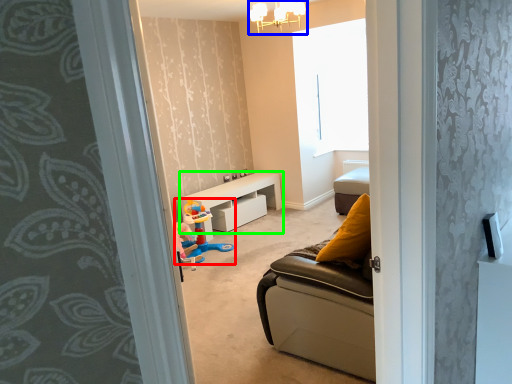
Question: Which is farther away from toy (highlighted by a red box)? light fixture (highlighted by a blue box) or table (highlighted by a green box)?

Choices:
 (A) light fixture
 (B) table

Answer: (A)